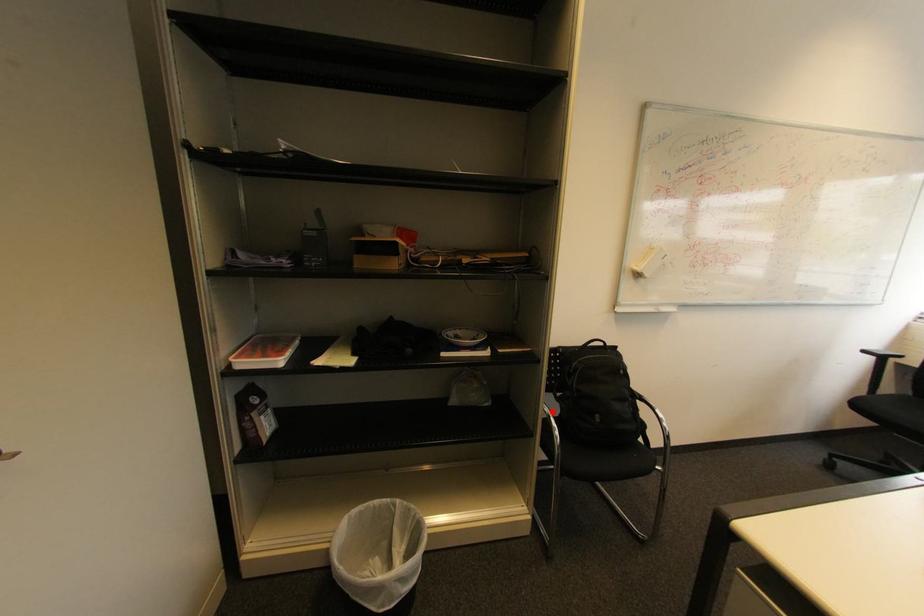
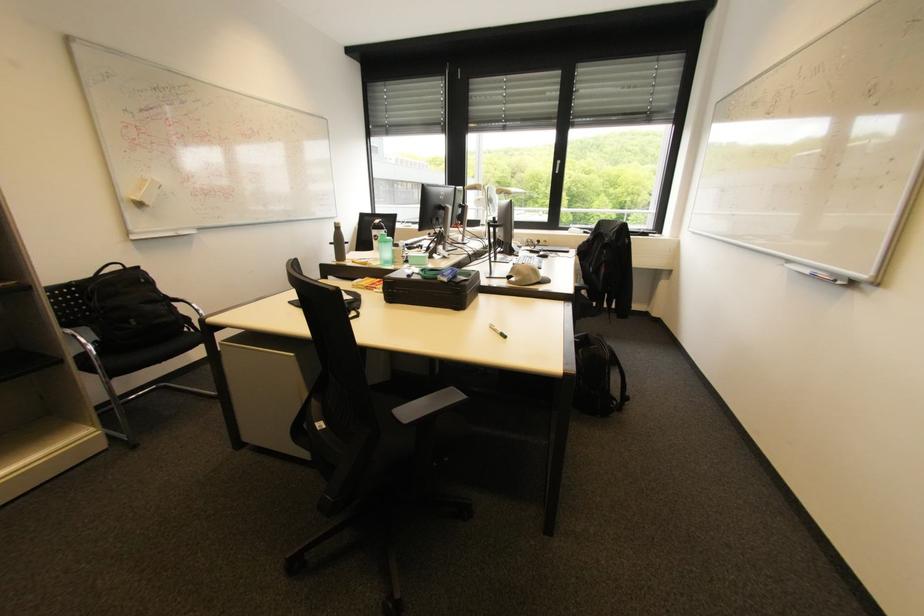
Where in the second image is the point corresponding to the highlighted location from the first image?

(74, 331)